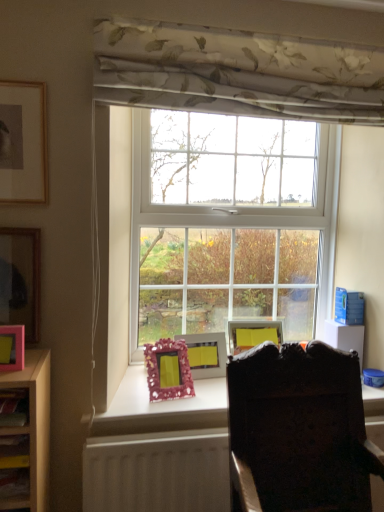
Locate an element on the screen. matte gold picture frame at upper left, the 5th picture frame from the bottom is located at coordinates pos(23,142).

Locate an element on the screen. The image size is (384, 512). white plastic window at center is located at coordinates (231, 208).

What do you see at coordinates (206, 354) in the screenshot?
I see `matte pink picture frame at center, the first picture frame in the back-to-front sequence` at bounding box center [206, 354].

The image size is (384, 512). What do you see at coordinates (14, 445) in the screenshot? I see `matte pink shelf at lower left` at bounding box center [14, 445].

This screenshot has height=512, width=384. What do you see at coordinates (236, 72) in the screenshot?
I see `floral fabric curtain at upper center` at bounding box center [236, 72].

The height and width of the screenshot is (512, 384). Find the location of `pink glossy picture frame at left, the third picture frame ordered from the bottom`. pink glossy picture frame at left, the third picture frame ordered from the bottom is located at coordinates (12, 347).

The image size is (384, 512). I want to click on dark wood desk at lower center, so click(x=159, y=450).

You are a GUI agent. You are given a task and a screenshot of the screen. Output one action in this format:
    pyautogui.click(x=<x>, y=<y>)
    Task: Click on the matte gold picture frame at upper left, the fourth picture frame viewed from the right
    This screenshot has height=512, width=384.
    Given the screenshot: What is the action you would take?
    point(23,142)

Considering the relative positions of matte gold picture frame at upper left, the 1th picture frame viewed from the top, and pink glossy picture frame at left, the fifth picture frame positioned from the back, in the image provided, is matte gold picture frame at upper left, the 1th picture frame viewed from the top, behind pink glossy picture frame at left, the fifth picture frame positioned from the back,?

Yes, it is behind pink glossy picture frame at left, the fifth picture frame positioned from the back.

In the scene shown: Can you confirm if matte gold picture frame at upper left, the 2th picture frame in the front-to-back sequence, is positioned to the right of pink glossy picture frame at left, the third picture frame ordered from the bottom?

No, matte gold picture frame at upper left, the 2th picture frame in the front-to-back sequence, is not to the right of pink glossy picture frame at left, the third picture frame ordered from the bottom.

Based on the photo, from the image's perspective, which one is positioned higher, matte gold picture frame at upper left, acting as the 2th picture frame starting from the left, or pink glossy picture frame at left, the first picture frame when ordered from front to back?

matte gold picture frame at upper left, acting as the 2th picture frame starting from the left, appears higher in the image.

Which of these two, matte pink shelf at lower left or matte pink picture frame at center, the first picture frame in the back-to-front sequence, is thinner?

Thinner between the two is matte pink picture frame at center, the first picture frame in the back-to-front sequence.

Would you say matte pink shelf at lower left is to the left or to the right of matte pink picture frame at center, which appears as the 1th picture frame when viewed from the right, in the picture?

Clearly, matte pink shelf at lower left is on the left of matte pink picture frame at center, which appears as the 1th picture frame when viewed from the right, in the image.

Which of these two, matte pink shelf at lower left or matte pink picture frame at center, which appears as the 1th picture frame when viewed from the right, is bigger?

Bigger between the two is matte pink picture frame at center, which appears as the 1th picture frame when viewed from the right.

Do you think matte pink shelf at lower left is within matte pink picture frame at center, which is counted as the 4th picture frame, starting from the top, or outside of it?

matte pink shelf at lower left is not inside matte pink picture frame at center, which is counted as the 4th picture frame, starting from the top, it's outside.

Does pink matte picture frame at left, the second picture frame from the top, lie in front of dark wood desk at lower center?

Yes.

Where is `the 1st picture frame in front of the dark wood desk at lower center, counting from the anchor's position`? the 1st picture frame in front of the dark wood desk at lower center, counting from the anchor's position is located at coordinates (21, 279).

Is pink matte picture frame at left, marked as the fifth picture frame in a right-to-left arrangement, facing towards dark wood desk at lower center?

No, pink matte picture frame at left, marked as the fifth picture frame in a right-to-left arrangement, is not oriented towards dark wood desk at lower center.

How different are the orientations of pink matte picture frame at left, acting as the first picture frame starting from the left, and dark wood desk at lower center in degrees?

1.54 degrees.

Can you confirm if dark wood chair at center is positioned to the left of dark wood desk at lower center?

Incorrect, dark wood chair at center is not on the left side of dark wood desk at lower center.

Who is taller, dark wood chair at center or dark wood desk at lower center?

Standing taller between the two is dark wood chair at center.

Could you tell me if dark wood chair at center is turned towards dark wood desk at lower center?

No, dark wood chair at center is not oriented towards dark wood desk at lower center.

Measure the distance from dark wood chair at center to dark wood desk at lower center.

11.31 inches.

Is pink glossy picture frame at left, acting as the 3th picture frame starting from the left, bigger than pink glittery picture frame at center, the 1th picture frame in the bottom-to-top sequence?

No, pink glossy picture frame at left, acting as the 3th picture frame starting from the left, is not bigger than pink glittery picture frame at center, the 1th picture frame in the bottom-to-top sequence.

From their relative heights in the image, would you say pink glossy picture frame at left, acting as the third picture frame starting from the top, is taller or shorter than pink glittery picture frame at center, positioned as the 4th picture frame in front-to-back order?

In the image, pink glossy picture frame at left, acting as the third picture frame starting from the top, appears to be shorter than pink glittery picture frame at center, positioned as the 4th picture frame in front-to-back order.

Is pink glossy picture frame at left, the first picture frame when ordered from front to back, positioned with its back to pink glittery picture frame at center, which appears as the 4th picture frame when viewed from the left?

No, pink glossy picture frame at left, the first picture frame when ordered from front to back,'s orientation is not away from pink glittery picture frame at center, which appears as the 4th picture frame when viewed from the left.

From a real-world perspective, does pink glossy picture frame at left, acting as the 3th picture frame starting from the left, stand above pink glittery picture frame at center, the second picture frame from the right?

Yes, from a real-world perspective, pink glossy picture frame at left, acting as the 3th picture frame starting from the left, is above pink glittery picture frame at center, the second picture frame from the right.

Looking at this image, considering the relative sizes of floral fabric curtain at upper center and dark wood desk at lower center in the image provided, is floral fabric curtain at upper center bigger than dark wood desk at lower center?

Indeed, floral fabric curtain at upper center has a larger size compared to dark wood desk at lower center.

Is floral fabric curtain at upper center positioned far away from dark wood desk at lower center?

Yes, floral fabric curtain at upper center and dark wood desk at lower center are located far from each other.

Which is in front, point (167, 93) or point (377, 413)?

The point (167, 93) is more forward.

Which is in front, floral fabric curtain at upper center or dark wood desk at lower center?

floral fabric curtain at upper center.

From the pink matte picture frame at left, marked as the fifth picture frame in a right-to-left arrangement, count 1st picture frame to the right and point to it. Please provide its 2D coordinates.

[(23, 142)]

Which is closer, (x=27, y=238) or (x=10, y=86)?

Point (x=27, y=238) appears to be farther away from the viewer than point (x=10, y=86).

Between pink matte picture frame at left, acting as the first picture frame starting from the left, and matte gold picture frame at upper left, the 2th picture frame in the front-to-back sequence, which one has smaller size?

Smaller between the two is pink matte picture frame at left, acting as the first picture frame starting from the left.

Find the location of a particular element. The image size is (384, 512). picture frame in front of the matte gold picture frame at upper left, the fourth picture frame viewed from the right is located at coordinates [x=12, y=347].

Identify the location of shelf to the left of matte pink picture frame at center, which is counted as the 4th picture frame, starting from the top. (14, 445).

Based on their spatial positions, is pink glossy picture frame at left, the third picture frame ordered from the bottom, or matte pink shelf at lower left closer to pink glittery picture frame at center, the fifth picture frame viewed from the top?

pink glossy picture frame at left, the third picture frame ordered from the bottom, lies closer to pink glittery picture frame at center, the fifth picture frame viewed from the top, than the other object.

Estimate the real-world distances between objects in this image. Which object is further from white plastic window at center, dark wood desk at lower center or pink matte picture frame at left, marked as the fifth picture frame in a right-to-left arrangement?

The object further to white plastic window at center is pink matte picture frame at left, marked as the fifth picture frame in a right-to-left arrangement.

Based on their spatial positions, is pink matte picture frame at left, marked as the fifth picture frame in a right-to-left arrangement, or pink glittery picture frame at center, which ranks as the 2th picture frame in back-to-front order, further from dark wood desk at lower center?

pink matte picture frame at left, marked as the fifth picture frame in a right-to-left arrangement.

From the image, which object appears to be nearer to matte gold picture frame at upper left, acting as the 2th picture frame starting from the left, matte pink shelf at lower left or dark wood chair at center?

matte pink shelf at lower left is closer to matte gold picture frame at upper left, acting as the 2th picture frame starting from the left.

Which object lies nearer to the anchor point dark wood desk at lower center, pink glittery picture frame at center, which ranks as the 2th picture frame in back-to-front order, or pink matte picture frame at left, the second picture frame from the top?

Based on the image, pink glittery picture frame at center, which ranks as the 2th picture frame in back-to-front order, appears to be nearer to dark wood desk at lower center.

Looking at the image, which one is located further to pink glossy picture frame at left, acting as the 3th picture frame starting from the left, white plastic window at center or dark wood desk at lower center?

white plastic window at center.

Considering their positions, is matte pink picture frame at center, which appears as the 1th picture frame when viewed from the right, positioned further to dark wood desk at lower center than matte gold picture frame at upper left, the 2th picture frame in the front-to-back sequence?

matte gold picture frame at upper left, the 2th picture frame in the front-to-back sequence, is positioned further to the anchor dark wood desk at lower center.

Based on their spatial positions, is matte pink picture frame at center, which is counted as the 4th picture frame, starting from the top, or matte pink shelf at lower left closer to white plastic window at center?

matte pink picture frame at center, which is counted as the 4th picture frame, starting from the top.

Locate an element on the screen. The image size is (384, 512). window between floral fabric curtain at upper center and pink glossy picture frame at left, the fifth picture frame positioned from the back, in the vertical direction is located at coordinates (231, 208).

Where is `curtain between matte gold picture frame at upper left, the fourth picture frame viewed from the right, and white plastic window at center from left to right`? curtain between matte gold picture frame at upper left, the fourth picture frame viewed from the right, and white plastic window at center from left to right is located at coordinates (x=236, y=72).

The width and height of the screenshot is (384, 512). I want to click on picture frame between matte gold picture frame at upper left, arranged as the fourth picture frame when viewed from the back, and pink glossy picture frame at left, the fifth picture frame positioned from the back, from top to bottom, so click(x=21, y=279).

The height and width of the screenshot is (512, 384). In order to click on shelf between dark wood chair at center and matte pink picture frame at center, which appears as the 1th picture frame when viewed from the right, in the front-back direction in this screenshot , I will do point(14,445).